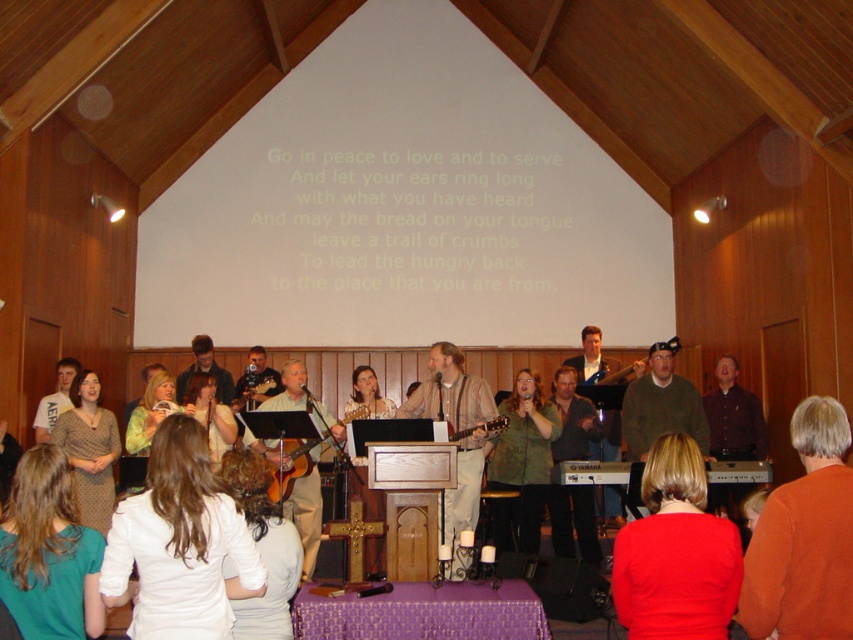
Which is above, red matte sweater at lower right or green textured sweater at center?

red matte sweater at lower right is higher up.

Is red matte sweater at lower right to the right of green textured sweater at center from the viewer's perspective?

Yes, red matte sweater at lower right is to the right of green textured sweater at center.

Between point (729, 596) and point (527, 412), which one is positioned behind?

Point (527, 412)

Where is `red matte sweater at lower right`? red matte sweater at lower right is located at coordinates (676, 552).

Is green fabric shirt at lower left smaller than dark brown leather jacket at center?

Correct, green fabric shirt at lower left occupies less space than dark brown leather jacket at center.

Can you confirm if green fabric shirt at lower left is positioned to the left of dark brown leather jacket at center?

Indeed, green fabric shirt at lower left is positioned on the left side of dark brown leather jacket at center.

Does point (56, 456) lie behind point (572, 396)?

No.

The image size is (853, 640). Find the location of `green fabric shirt at lower left`. green fabric shirt at lower left is located at coordinates (49, 552).

Is point (611, 572) positioned in front of point (39, 429)?

Yes, it is in front of point (39, 429).

Does red matte sweater at lower right appear under white t-shirt at lower left?

Yes.

Image resolution: width=853 pixels, height=640 pixels. Describe the element at coordinates (676, 552) in the screenshot. I see `red matte sweater at lower right` at that location.

Where is `red matte sweater at lower right`? Image resolution: width=853 pixels, height=640 pixels. red matte sweater at lower right is located at coordinates (676, 552).